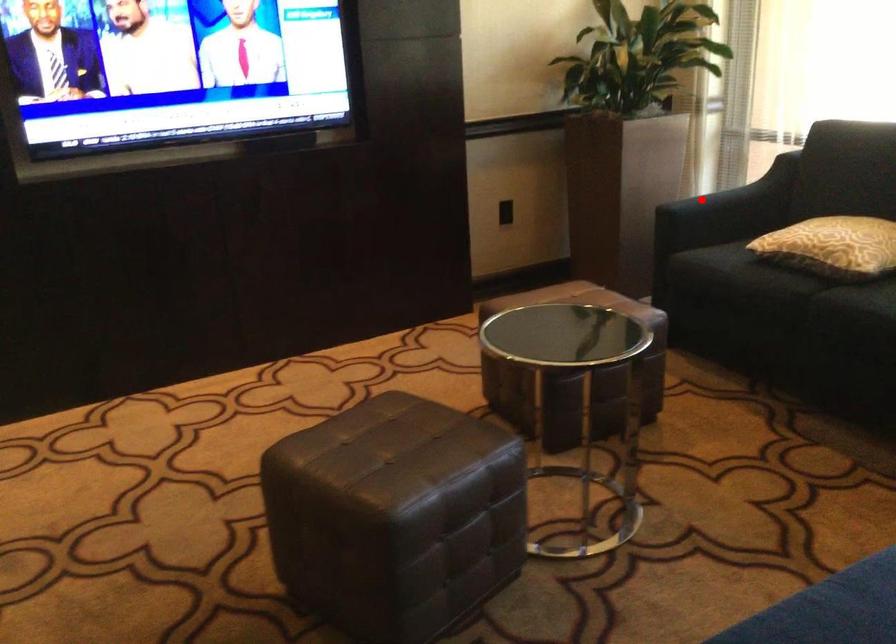
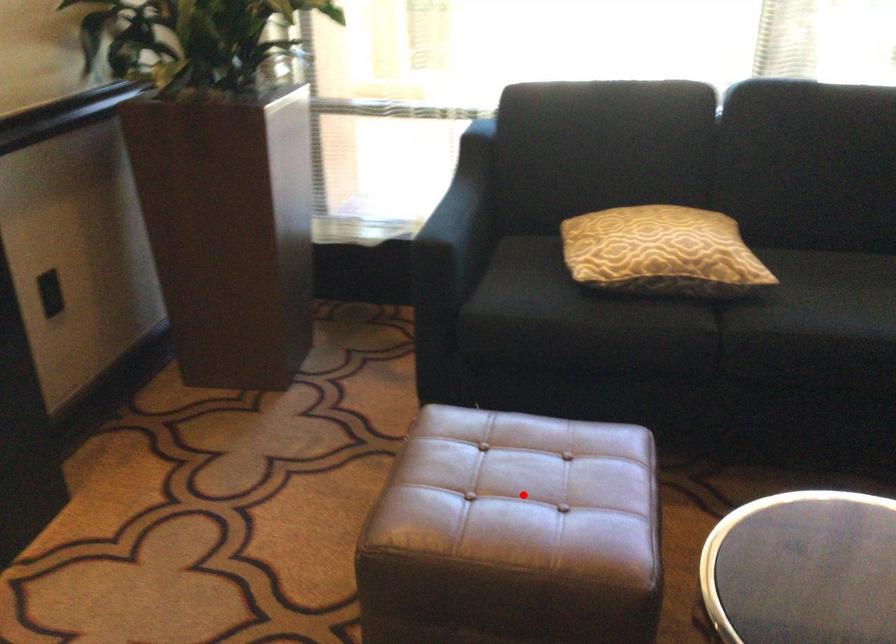
I am providing you with two images of the same scene from different viewpoints. A red point is marked on the first image and another point is marked on the second image. Does the point marked in image1 correspond to the same location as the one in image2?

No